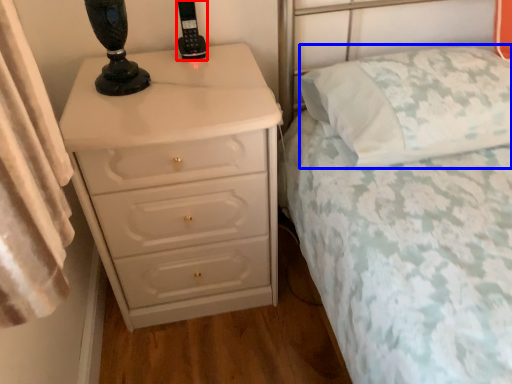
Question: Which object appears closest to the camera in this image, control (highlighted by a red box) or pillow (highlighted by a blue box)?

Choices:
 (A) control
 (B) pillow

Answer: (B)